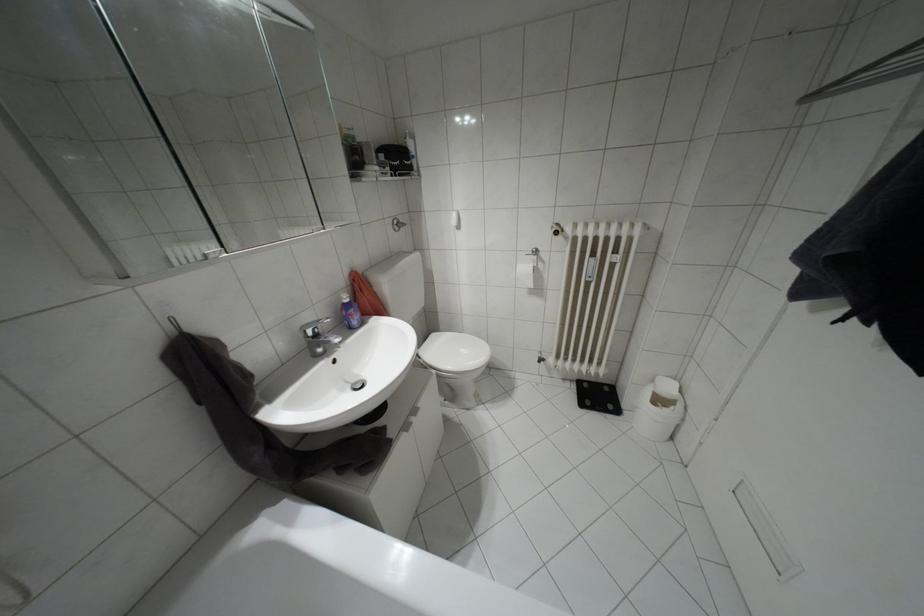
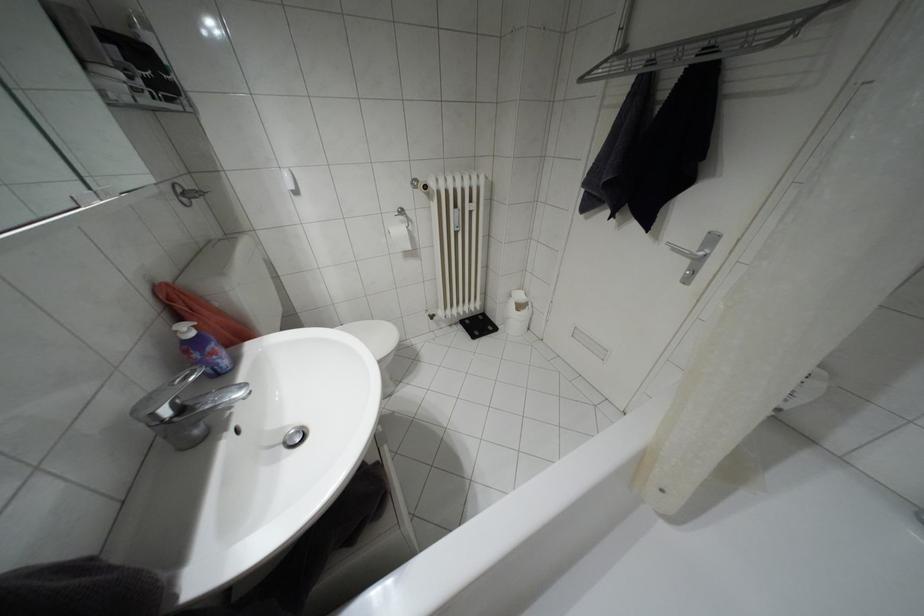
Locate, in the second image, the point that corresponds to [346,300] in the first image.

(190, 333)